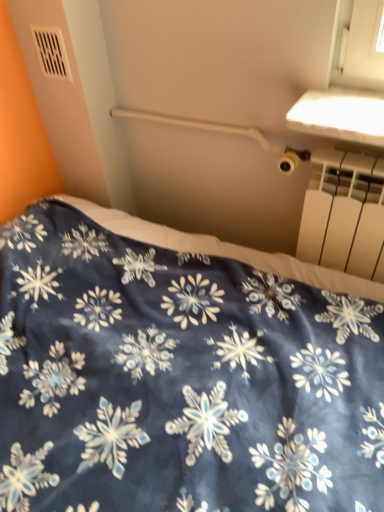
Describe the element at coordinates (51, 52) in the screenshot. This screenshot has width=384, height=512. I see `white plastic vent at upper left` at that location.

This screenshot has width=384, height=512. In order to click on white plastic vent at upper left in this screenshot , I will do `click(51, 52)`.

What are the coordinates of `white plastic vent at upper left` in the screenshot? It's located at (51, 52).